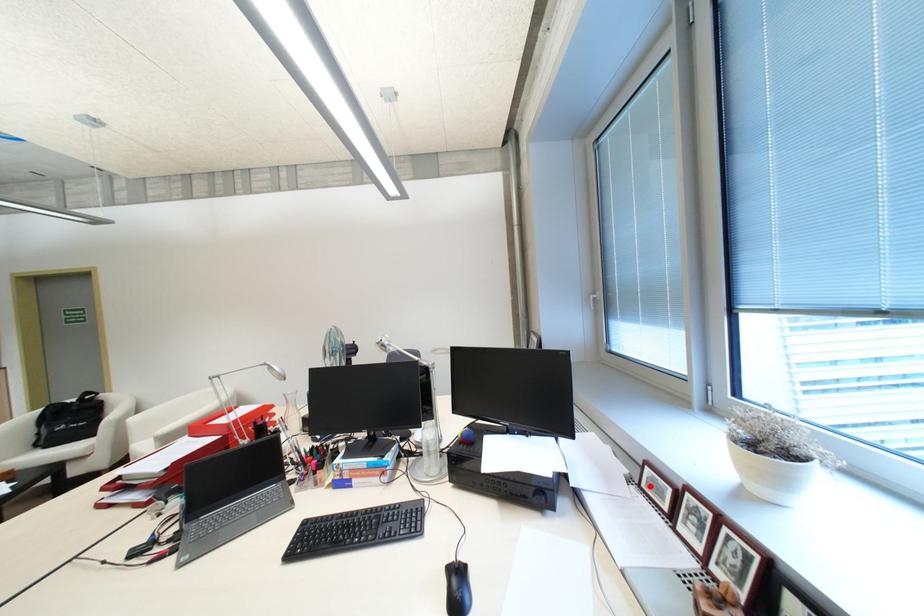
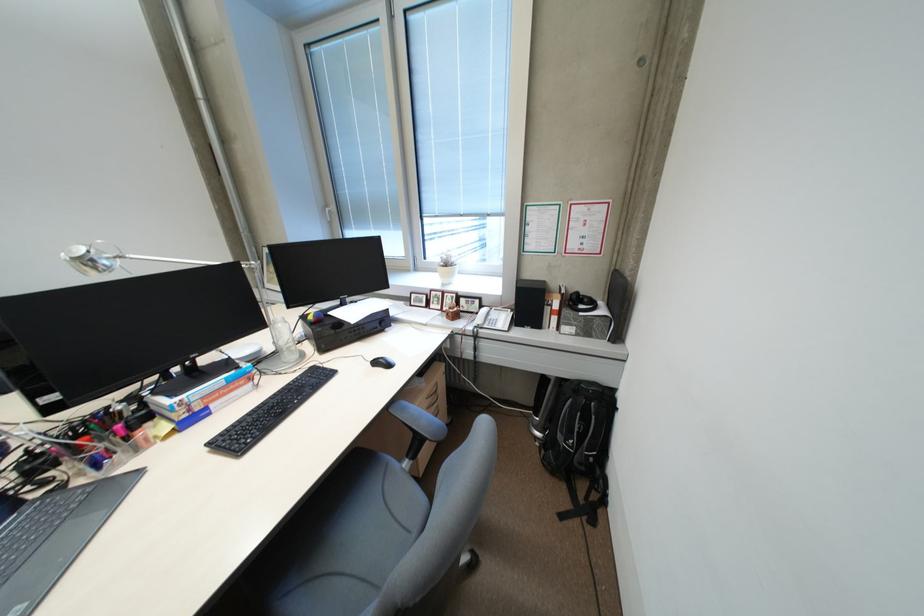
Where in the second image is the point corresponding to the highlighted location from the first image?

(420, 305)